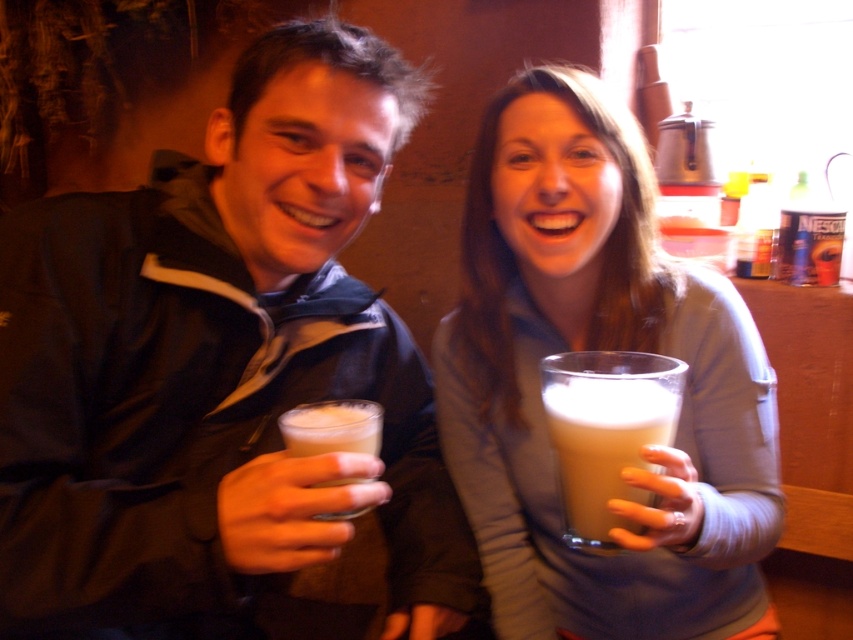
Question: Which object is closer to the camera taking this photo?

Choices:
 (A) matte glass mug at center
 (B) white frothy foam at left

Answer: (A)

Question: Can you confirm if matte black jacket at center is positioned above white frothy foam at left?

Choices:
 (A) yes
 (B) no

Answer: (A)

Question: From the image, what is the correct spatial relationship of matte black jacket at center in relation to matte glass mug at center?

Choices:
 (A) right
 (B) left

Answer: (B)

Question: Among these points, which one is nearest to the camera?

Choices:
 (A) (601, 412)
 (B) (590, 161)
 (C) (412, 365)
 (D) (329, 410)

Answer: (A)

Question: Is matte glass mug at center bigger than foamy white liquid at center?

Choices:
 (A) yes
 (B) no

Answer: (A)

Question: Which object is the farthest from the foamy white liquid at center?

Choices:
 (A) white frothy foam at left
 (B) matte black jacket at center
 (C) matte glass mug at center

Answer: (B)